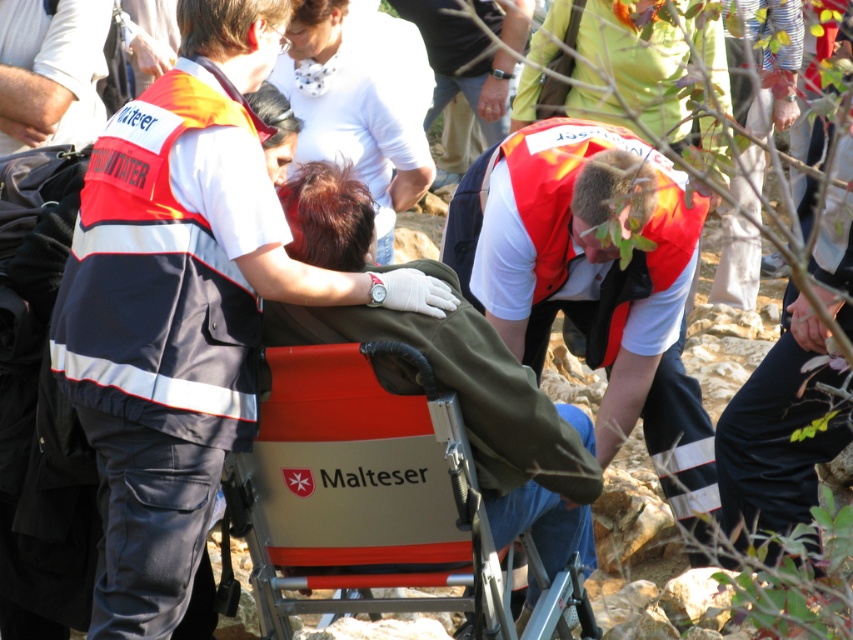
Can you confirm if red aluminum malteser stretcher at center is smaller than orange reflective vest at center?

Yes, red aluminum malteser stretcher at center is smaller than orange reflective vest at center.

Does point (283, 540) lie behind point (479, 120)?

No, (283, 540) is closer to viewer.

This screenshot has width=853, height=640. I want to click on red aluminum malteser stretcher at center, so click(358, 484).

Which is below, red reflective vest at center or orange reflective vest at center?

red reflective vest at center is lower down.

Does red reflective vest at center appear on the left side of orange reflective vest at center?

No, red reflective vest at center is not to the left of orange reflective vest at center.

Between point (625, 333) and point (450, 97), which one is positioned behind?

Point (450, 97)

Where is `red reflective vest at center`? The height and width of the screenshot is (640, 853). red reflective vest at center is located at coordinates (593, 282).

Between reflective orange vest at center and red reflective vest at center, which one is positioned higher?

reflective orange vest at center is higher up.

Does reflective orange vest at center appear on the right side of red reflective vest at center?

In fact, reflective orange vest at center is to the left of red reflective vest at center.

Which is behind, point (257, 282) or point (700, 216)?

Point (700, 216)

Identify the location of reflective orange vest at center. (183, 305).